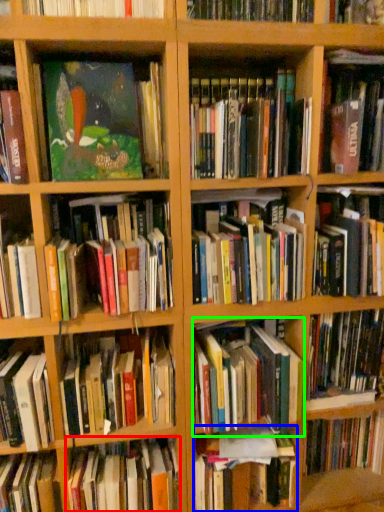
Question: Based on their relative distances, which object is farther from book (highlighted by a red box)? Choose from book (highlighted by a blue box) and book (highlighted by a green box).

Choices:
 (A) book
 (B) book

Answer: (B)